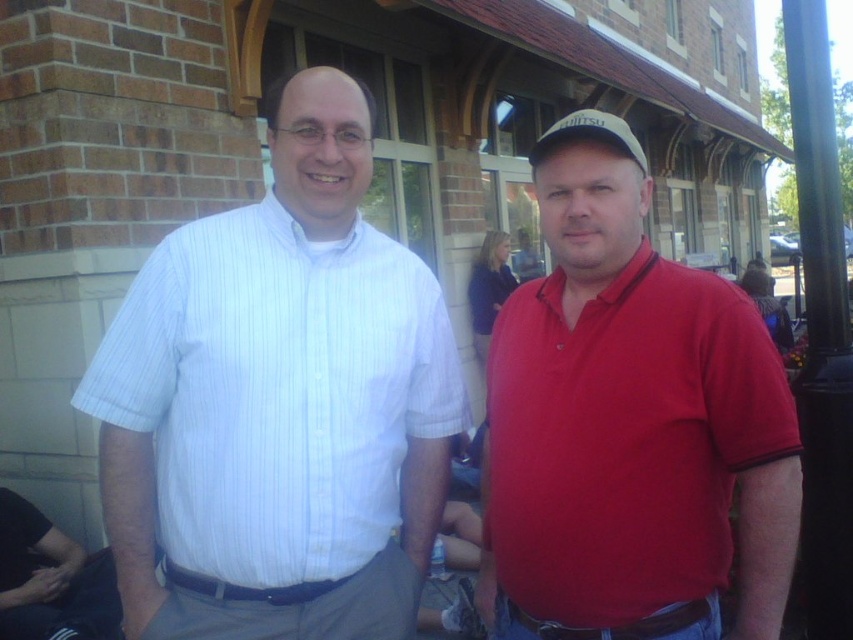
Can you confirm if white striped shirt at left is taller than matte red polo shirt at center?

Indeed, white striped shirt at left has a greater height compared to matte red polo shirt at center.

Does white striped shirt at left have a greater width compared to matte red polo shirt at center?

Yes, white striped shirt at left is wider than matte red polo shirt at center.

Between point (135, 397) and point (741, 554), which one is positioned in front?

Point (741, 554) is more forward.

The image size is (853, 640). Find the location of `white striped shirt at left`. white striped shirt at left is located at coordinates (279, 404).